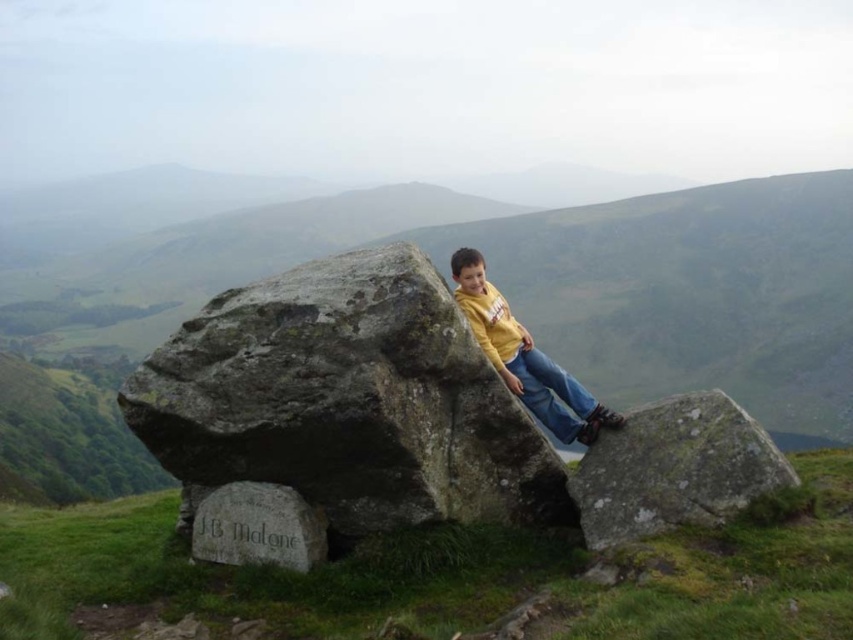
Question: Is the position of green mossy rock at right more distant than that of yellow matte shirt at center?

Choices:
 (A) yes
 (B) no

Answer: (B)

Question: Which of the following is the closest to the observer?

Choices:
 (A) green mossy rock at center
 (B) gray stone at lower center

Answer: (B)

Question: Does green mossy rock at right have a greater width compared to gray stone at lower center?

Choices:
 (A) yes
 (B) no

Answer: (A)

Question: Estimate the real-world distances between objects in this image. Which object is farther from the green mossy rock at right?

Choices:
 (A) green mossy rock at center
 (B) rough stone boulder at center

Answer: (A)

Question: Is rough stone boulder at center to the right of gray stone at lower center from the viewer's perspective?

Choices:
 (A) no
 (B) yes

Answer: (B)

Question: Which point is closer to the camera taking this photo?

Choices:
 (A) pos(698,410)
 (B) pos(189,400)

Answer: (B)